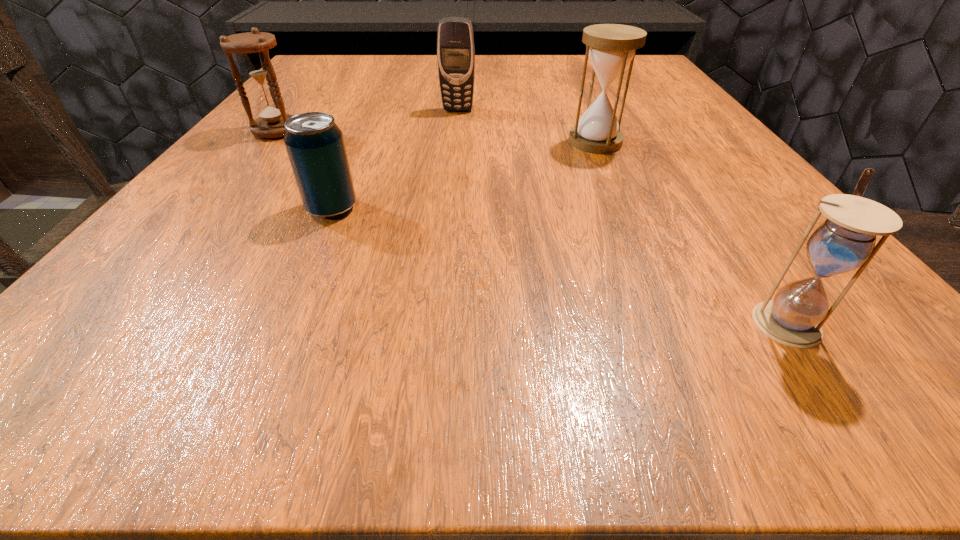
Identify the location of free space located 0.310m on the back of the leftmost hourglass. (326, 69).

Locate an element on the screen. This screenshot has height=540, width=960. blank space located on the left of the nearest object is located at coordinates (444, 321).

This screenshot has height=540, width=960. Find the location of `vacant space located on the right of the shortest object`. vacant space located on the right of the shortest object is located at coordinates (437, 208).

This screenshot has height=540, width=960. Identify the location of object positioned at the near edge. (846, 240).

The image size is (960, 540). In order to click on object that is at the left edge in this screenshot , I will do `click(253, 47)`.

Locate an element on the screen. The height and width of the screenshot is (540, 960). object located in the right edge section of the desktop is located at coordinates (846, 240).

The width and height of the screenshot is (960, 540). Identify the location of object at the near right corner. (846, 240).

At what (x,y) coordinates should I click in order to perform the action: click on free location at the far edge of the desktop. Please return your answer as a coordinate pair (x, y). Looking at the image, I should click on (552, 59).

This screenshot has width=960, height=540. Identify the location of vacant region at the near edge. (513, 325).

I want to click on vacant area at the left edge of the desktop, so click(x=294, y=102).